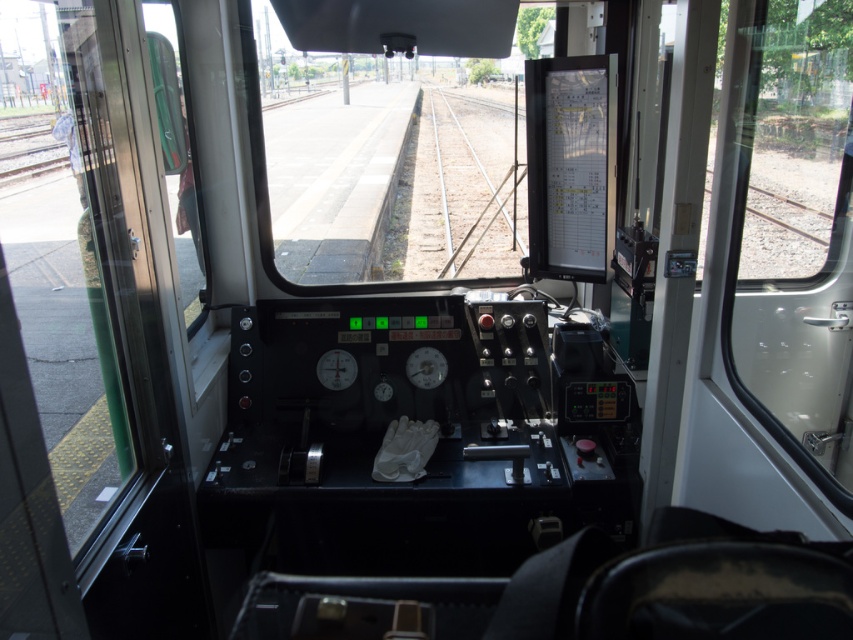
You are a train operator who needs to check the distance between the transparent glass window at right and the metallic silver train track at center. Which object is shorter in height?

The transparent glass window at right is shorter than the metallic silver train track at center.

You are a train operator who needs to check the distance between the transparent glass window at right and the metallic silver train track at center. Which one is wider in terms of their width?

The transparent glass window at right is wider than the metallic silver train track at center.